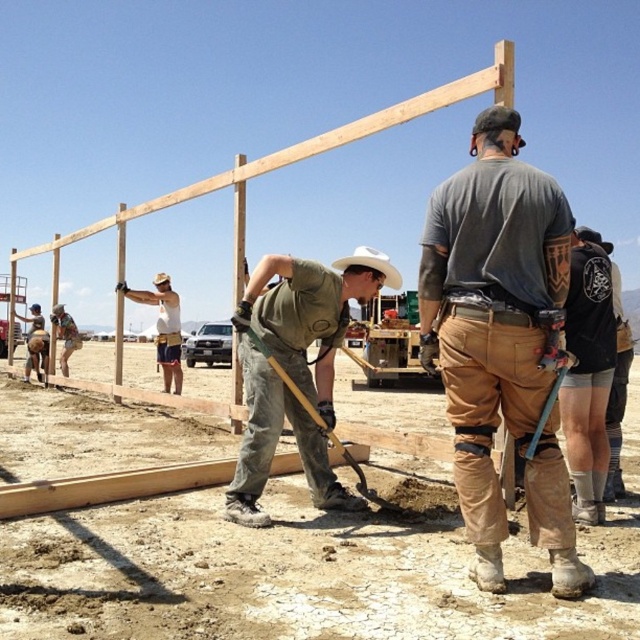
Is brown/khaki pants at center positioned before green matte shirt at center?

A: That is True.

Can you confirm if brown/khaki pants at center is positioned below green matte shirt at center?

No, brown/khaki pants at center is not below green matte shirt at center.

At what (x,y) coordinates should I click in order to perform the action: click on brown/khaki pants at center. Please return your answer as a coordinate pair (x, y). Looking at the image, I should click on (492, 314).